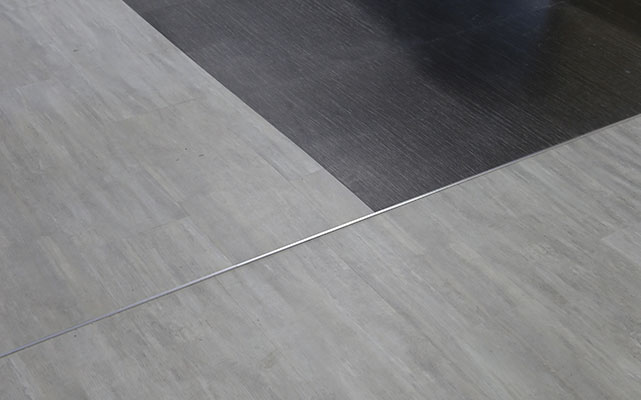
You are a GUI agent. You are given a task and a screenshot of the screen. Output one action in this format:
    pyautogui.click(x=<x>, y=<y>)
    Task: Click on the gray laminate flooring on bottom of image
    The width and height of the screenshot is (641, 400).
    Given the screenshot: What is the action you would take?
    pyautogui.click(x=379, y=336)